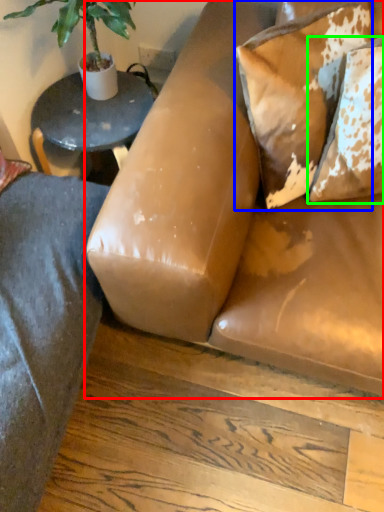
Question: Which is farther away from studio couch (highlighted by a red box)? pillow (highlighted by a blue box) or pillow (highlighted by a green box)?

Choices:
 (A) pillow
 (B) pillow

Answer: (B)